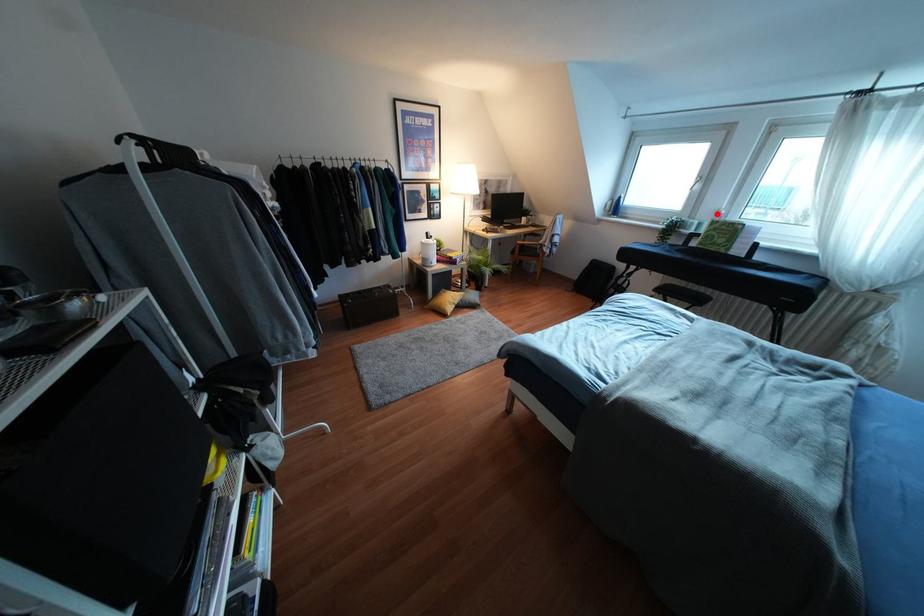
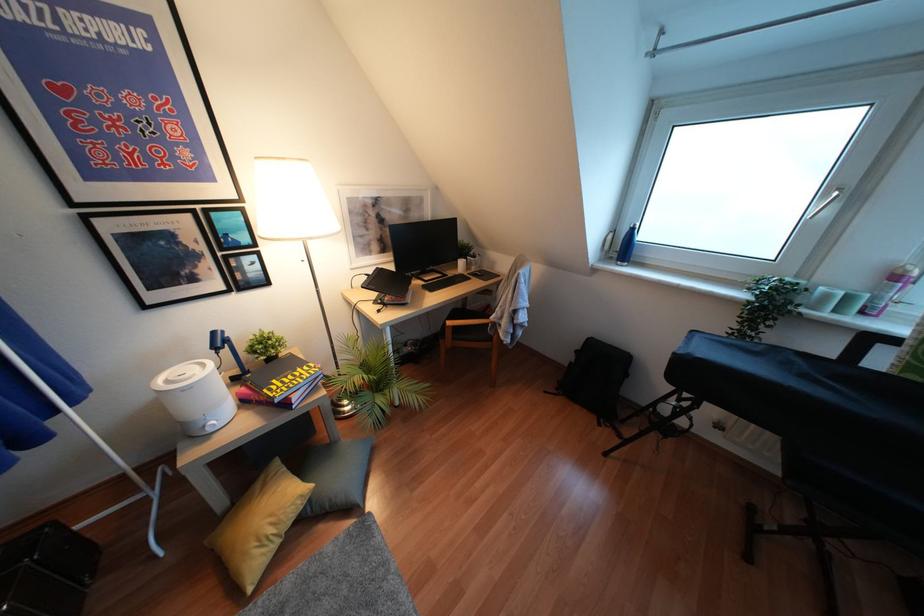
Question: I am providing you with two images of the same scene from different viewpoints. In image1, a red point is highlighted. Considering the same 3D point in image2, which of the following is correct?

Choices:
 (A) It is closer
 (B) It is farther

Answer: (B)